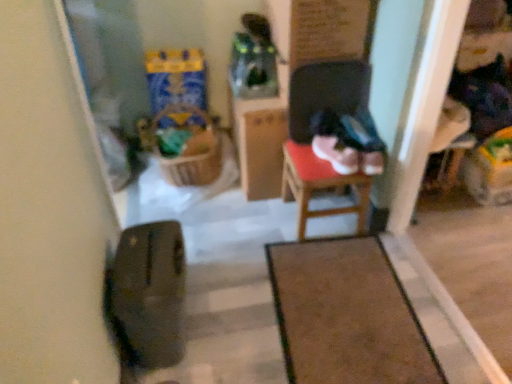
Question: Is wooden chair at center at the left side of transparent glass door at left?

Choices:
 (A) no
 (B) yes

Answer: (A)

Question: Is wooden chair at center closer to the viewer compared to transparent glass door at left?

Choices:
 (A) yes
 (B) no

Answer: (B)

Question: Is there a large distance between wooden chair at center and transparent glass door at left?

Choices:
 (A) no
 (B) yes

Answer: (A)

Question: Is wooden chair at center at the right side of transparent glass door at left?

Choices:
 (A) yes
 (B) no

Answer: (A)

Question: Does wooden chair at center have a lesser height compared to transparent glass door at left?

Choices:
 (A) no
 (B) yes

Answer: (B)

Question: From their relative heights in the image, would you say transparent glass door at left is taller or shorter than brown carpet at center?

Choices:
 (A) short
 (B) tall

Answer: (B)

Question: From a real-world perspective, is transparent glass door at left above or below brown carpet at center?

Choices:
 (A) below
 (B) above

Answer: (B)

Question: Does point (117, 34) appear closer or farther from the camera than point (296, 327)?

Choices:
 (A) closer
 (B) farther

Answer: (B)

Question: From the image's perspective, is transparent glass door at left above or below brown carpet at center?

Choices:
 (A) above
 (B) below

Answer: (A)

Question: Is woven brown laundry basket at center in front of or behind wooden chair at center in the image?

Choices:
 (A) behind
 (B) front

Answer: (A)

Question: Is woven brown laundry basket at center bigger or smaller than wooden chair at center?

Choices:
 (A) big
 (B) small

Answer: (A)

Question: In terms of width, does woven brown laundry basket at center look wider or thinner when compared to wooden chair at center?

Choices:
 (A) thin
 (B) wide

Answer: (B)

Question: Is woven brown laundry basket at center taller or shorter than wooden chair at center?

Choices:
 (A) tall
 (B) short

Answer: (B)

Question: From a real-world perspective, is woven brown laundry basket at center physically located above or below brown carpet at center?

Choices:
 (A) below
 (B) above

Answer: (B)

Question: Considering the positions of point (190, 160) and point (271, 249), is point (190, 160) closer or farther from the camera than point (271, 249)?

Choices:
 (A) closer
 (B) farther

Answer: (B)